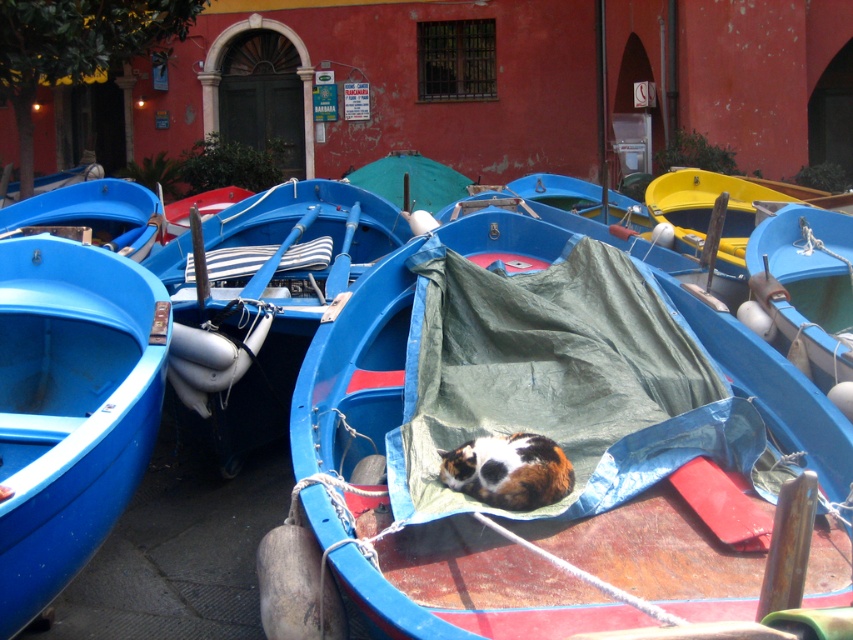
You are standing in the boatyard and want to determine which of the two points, point (692, 616) or point (44, 588), is nearer to you. Based on the scene, can you identify the closer one?

Point (692, 616) is closer to the viewer than point (44, 588).